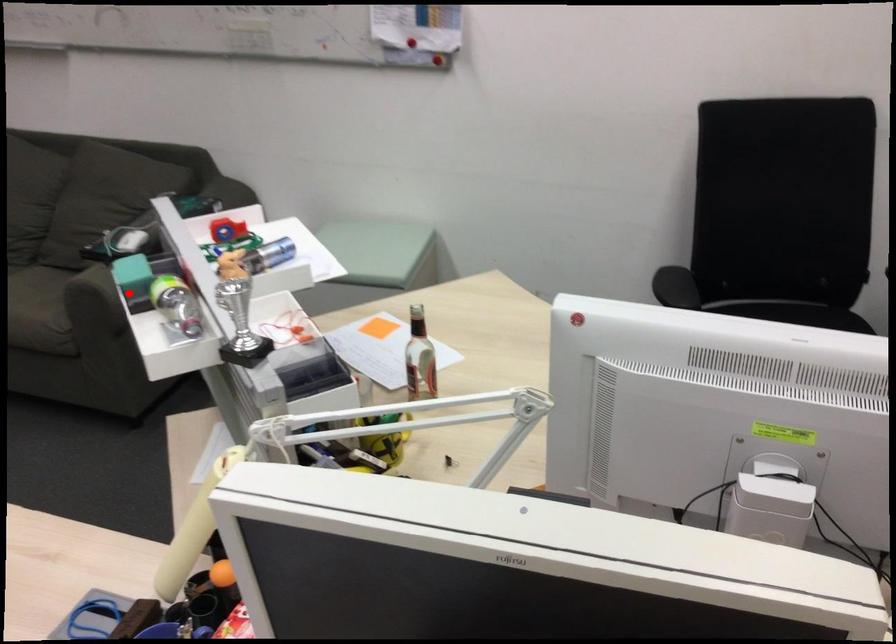
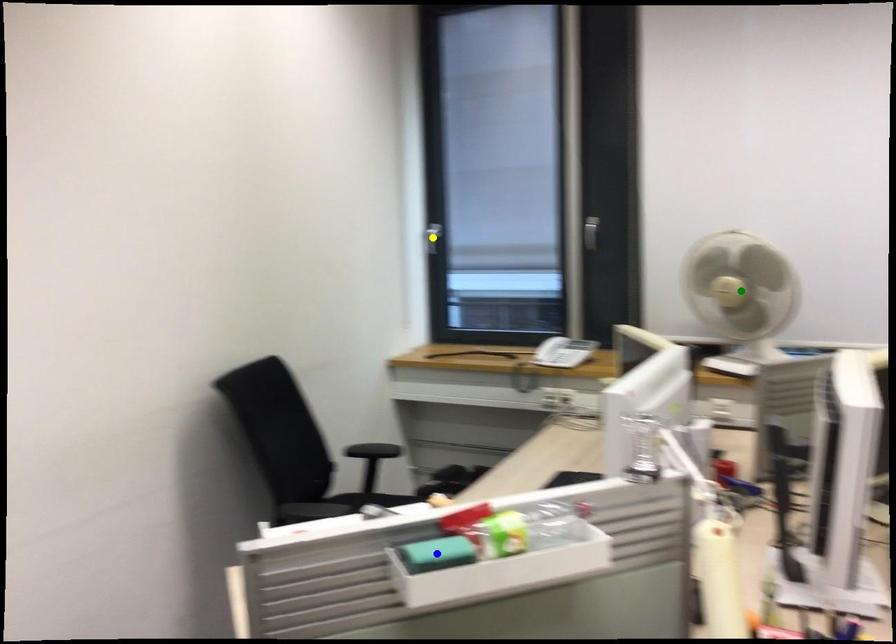
Question: I am providing you with two images of the same scene from different viewpoints. A red point is marked on the first image. You are given multiple points on the second image. Which point in image 2 is actually the same real-world point as the red point in image 1?

Choices:
 (A) green point
 (B) blue point
 (C) yellow point

Answer: (B)